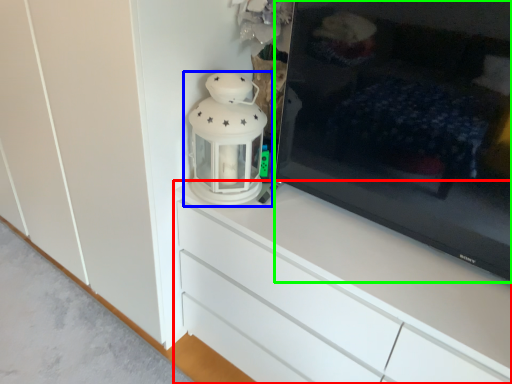
Question: Estimate the real-world distances between objects in this image. Which object is closer to chest of drawers (highlighted by a red box), lantern (highlighted by a blue box) or television (highlighted by a green box)?

Choices:
 (A) lantern
 (B) television

Answer: (A)